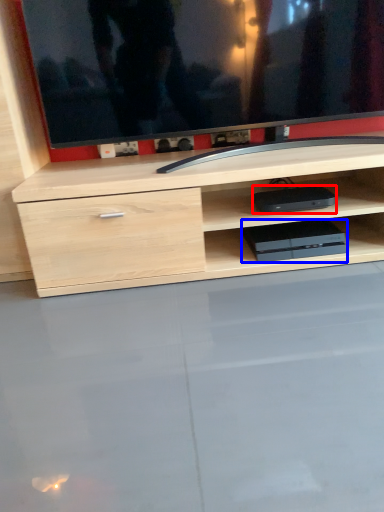
Question: Which of the following is the farthest to the observer, equipment (highlighted by a red box) or equipment (highlighted by a blue box)?

Choices:
 (A) equipment
 (B) equipment

Answer: (B)